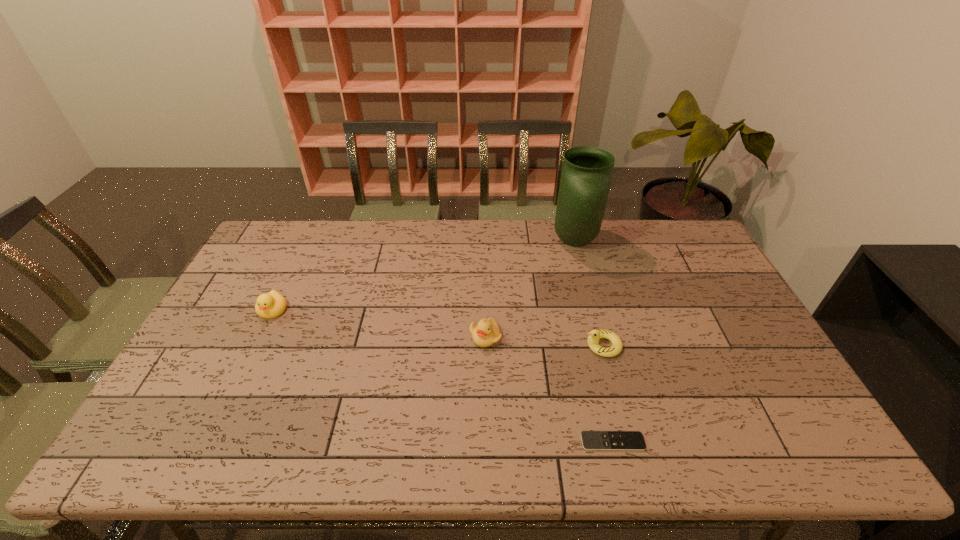
Locate an element on the screen. vase is located at coordinates (586, 174).

In order to click on the tallest object in this screenshot , I will do `click(586, 174)`.

Locate an element on the screen. This screenshot has height=540, width=960. the second object from left to right is located at coordinates (486, 333).

Image resolution: width=960 pixels, height=540 pixels. I want to click on the second farthest object, so click(x=273, y=304).

Locate an element on the screen. The height and width of the screenshot is (540, 960). the leftmost object is located at coordinates (273, 304).

Locate an element on the screen. The image size is (960, 540). the rightmost duckling is located at coordinates (595, 335).

This screenshot has width=960, height=540. What are the coordinates of `the nearest object` in the screenshot? It's located at (591, 440).

Where is `the shortest object`? the shortest object is located at coordinates (591, 440).

This screenshot has width=960, height=540. I want to click on free spot located 0.350m on the left of the farthest object, so click(x=455, y=241).

This screenshot has width=960, height=540. In order to click on free spot located 0.150m on the beak of the fourth object from right to left in this screenshot , I will do `click(486, 396)`.